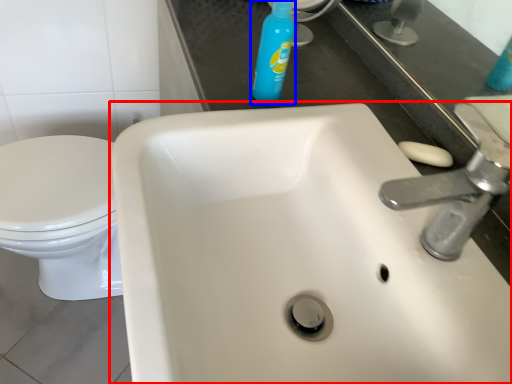
Question: Which of the following is the farthest to the observer, sink (highlighted by a red box) or cleaning product (highlighted by a blue box)?

Choices:
 (A) sink
 (B) cleaning product

Answer: (B)